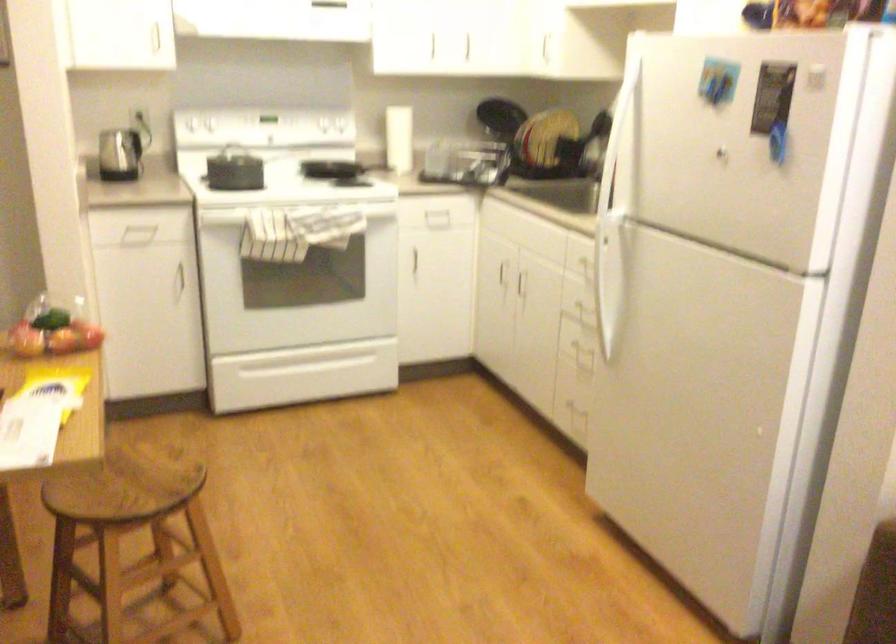
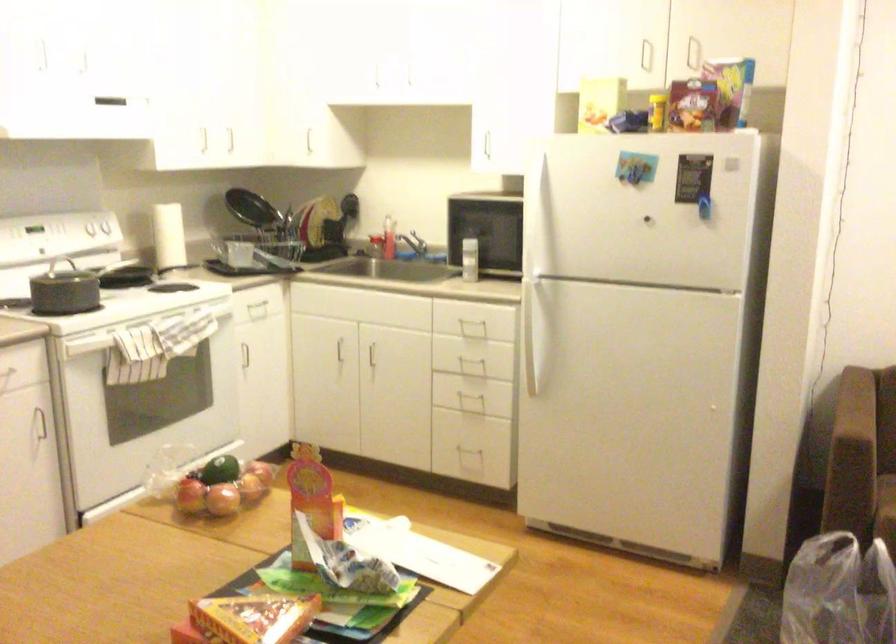
Question: I am providing you with two images of the same scene from different viewpoints. Please identify which objects are invisible in image2.

Choices:
 (A) white stein handle
 (B) white stove knob
 (C) oven door handle
 (D) paper towel roll

Answer: (D)